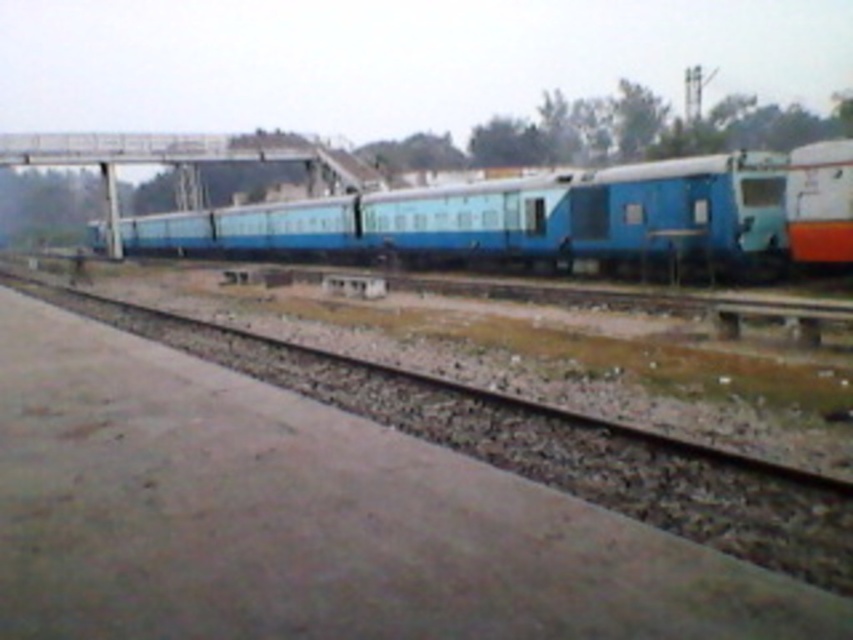
You are standing on the platform and want to walk towards the blue matte train car at center. Which direction should you move relative to the brown gravel track at lower left?

To reach the blue matte train car at center, you should move to the left of the brown gravel track at lower left since the blue matte train car at center is positioned to the left of it.

You are a railway inspector checking the alignment of the train cars. The blue matte train car at center and orange glossy train car at right are parked on the tracks. Which train car has a larger width between its sides?

The blue matte train car at center might be wider than orange glossy train car at right, so it has a larger width between its sides.

You are standing on the platform at the railway station and notice a specific point marked at coordinates point [543,445]. What object is located at that point?

The brown gravel track at lower left is located at point [543,445].